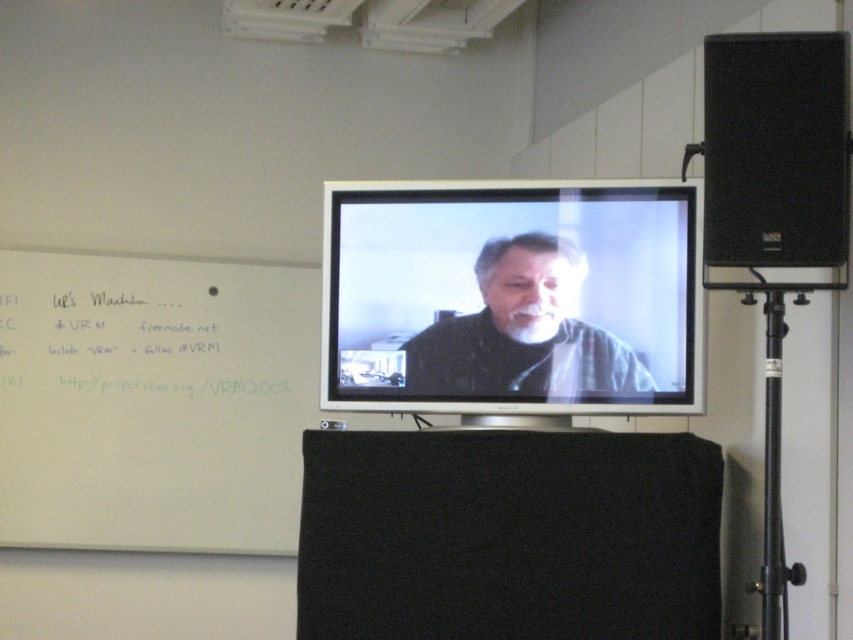
You are a student in the classroom and need to refer to both the white matte whiteboard at left and the white paper at upper left. Which object is closer to the left side of the room?

The white matte whiteboard at left is closer to the left side of the room because it is positioned to the left of the white paper at upper left.